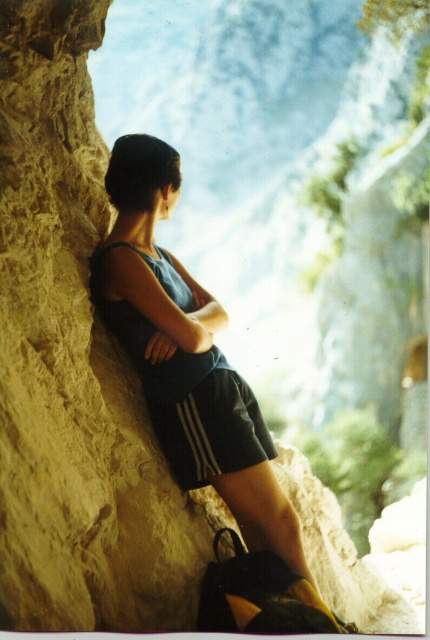
Who is more forward, [141,292] or [202,388]?

Positioned in front is point [141,292].

Describe the element at coordinates (186, 355) in the screenshot. I see `matte blue tank top at center` at that location.

Where is `matte blue tank top at center`? The width and height of the screenshot is (430, 640). matte blue tank top at center is located at coordinates coord(186,355).